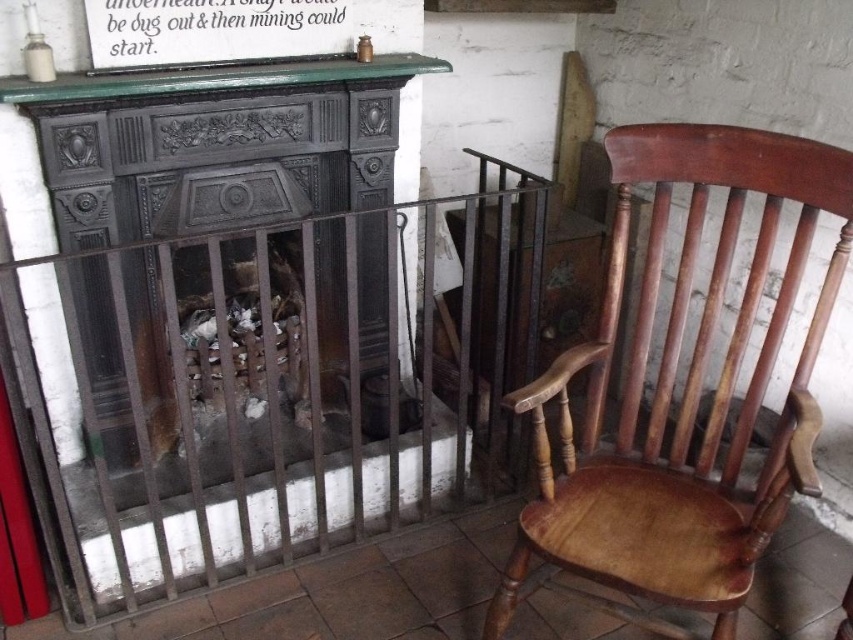
Question: Does wooden chair at right appear on the left side of green painted wood mantle at upper center?

Choices:
 (A) yes
 (B) no

Answer: (B)

Question: Among these points, which one is farthest from the camera?

Choices:
 (A) (595, 460)
 (B) (242, 148)

Answer: (B)

Question: Does wooden chair at right appear on the left side of green painted wood mantle at upper center?

Choices:
 (A) no
 (B) yes

Answer: (A)

Question: Which point is closer to the camera taking this photo?

Choices:
 (A) 808,156
 (B) 59,97

Answer: (A)

Question: Which point is farther to the camera?

Choices:
 (A) (392, 344)
 (B) (178, 72)
 (C) (704, 481)

Answer: (A)

Question: Can you confirm if dark gray cast iron fireplace at center is smaller than green painted wood mantle at upper center?

Choices:
 (A) no
 (B) yes

Answer: (A)